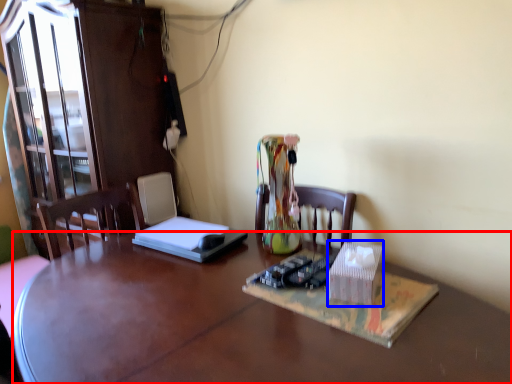
Question: Which object appears closest to the camera in this image, desk (highlighted by a red box) or cardboard box (highlighted by a blue box)?

Choices:
 (A) desk
 (B) cardboard box

Answer: (A)